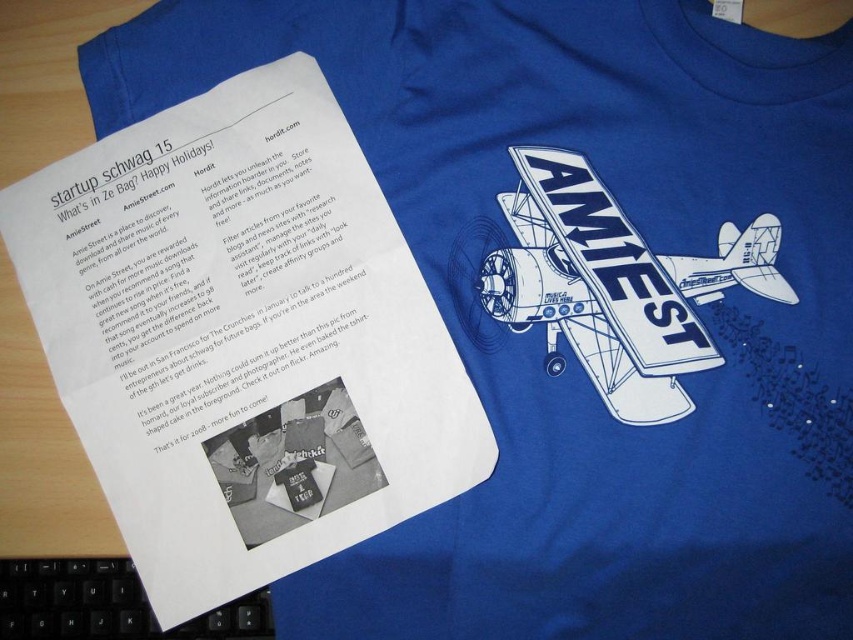
Question: Which point is farther from the camera taking this photo?

Choices:
 (A) (3, 593)
 (B) (709, 259)

Answer: (A)

Question: Can you confirm if white matte airplane at center is positioned above black plastic keyboard at lower left?

Choices:
 (A) no
 (B) yes

Answer: (B)

Question: Which point is closer to the camera taking this photo?

Choices:
 (A) (245, 602)
 (B) (747, 252)

Answer: (B)

Question: Does white matte airplane at center appear on the left side of black plastic keyboard at lower left?

Choices:
 (A) no
 (B) yes

Answer: (A)

Question: Which object is farther from the camera taking this photo?

Choices:
 (A) black plastic keyboard at lower left
 (B) white matte airplane at center

Answer: (A)

Question: Can you confirm if white matte airplane at center is positioned above black plastic keyboard at lower left?

Choices:
 (A) no
 (B) yes

Answer: (B)